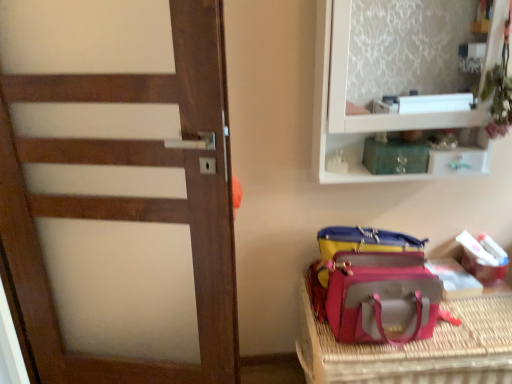
Question: Is white cardboard box at lower right, marked as the second kit in a front-to-back arrangement, at the left side of leatherette pet carrier at lower right?

Choices:
 (A) yes
 (B) no

Answer: (B)

Question: From a real-world perspective, is white cardboard box at lower right, marked as the second kit in a front-to-back arrangement, positioned over leatherette pet carrier at lower right based on gravity?

Choices:
 (A) no
 (B) yes

Answer: (B)

Question: Does white cardboard box at lower right, which is the 1th kit in right-to-left order, have a larger size compared to leatherette pet carrier at lower right?

Choices:
 (A) yes
 (B) no

Answer: (B)

Question: Does white cardboard box at lower right, the first kit when ordered from bottom to top, have a greater width compared to leatherette pet carrier at lower right?

Choices:
 (A) no
 (B) yes

Answer: (A)

Question: From a real-world perspective, does white cardboard box at lower right, which is the 1th kit in right-to-left order, sit lower than leatherette pet carrier at lower right?

Choices:
 (A) no
 (B) yes

Answer: (A)

Question: Relative to green glass jar at upper center, arranged as the second kit when ordered from the bottom, is white cardboard box at lower right, marked as the 2th kit in a top-to-bottom arrangement, in front or behind?

Choices:
 (A) behind
 (B) front

Answer: (A)

Question: Is point (503, 258) closer or farther from the camera than point (386, 163)?

Choices:
 (A) farther
 (B) closer

Answer: (A)

Question: Based on their positions, is white cardboard box at lower right, marked as the 2th kit in a top-to-bottom arrangement, located to the left or right of green glass jar at upper center, arranged as the second kit when ordered from the bottom?

Choices:
 (A) left
 (B) right

Answer: (B)

Question: In terms of width, does white cardboard box at lower right, marked as the second kit in a front-to-back arrangement, look wider or thinner when compared to green glass jar at upper center, arranged as the second kit when ordered from the bottom?

Choices:
 (A) wide
 (B) thin

Answer: (A)

Question: From the image's perspective, is green glass jar at upper center, the second kit in the back-to-front sequence, located above or below wooden door at left?

Choices:
 (A) below
 (B) above

Answer: (B)

Question: In terms of height, does green glass jar at upper center, the 1th kit positioned from the left, look taller or shorter compared to wooden door at left?

Choices:
 (A) tall
 (B) short

Answer: (B)

Question: Considering the relative positions of green glass jar at upper center, the 2th kit when ordered from right to left, and wooden door at left in the image provided, is green glass jar at upper center, the 2th kit when ordered from right to left, to the left or to the right of wooden door at left?

Choices:
 (A) left
 (B) right

Answer: (B)

Question: Is green glass jar at upper center, the second kit in the back-to-front sequence, spatially inside wooden door at left, or outside of it?

Choices:
 (A) outside
 (B) inside

Answer: (A)

Question: Considering the positions of green glass jar at upper center, the 1th kit in the top-to-bottom sequence, and white cardboard box at lower right, marked as the second kit in a front-to-back arrangement, in the image, is green glass jar at upper center, the 1th kit in the top-to-bottom sequence, bigger or smaller than white cardboard box at lower right, marked as the second kit in a front-to-back arrangement,?

Choices:
 (A) small
 (B) big

Answer: (A)

Question: Is green glass jar at upper center, the 2th kit when ordered from right to left, in front of or behind white cardboard box at lower right, which appears as the second kit when viewed from the left, in the image?

Choices:
 (A) front
 (B) behind

Answer: (A)